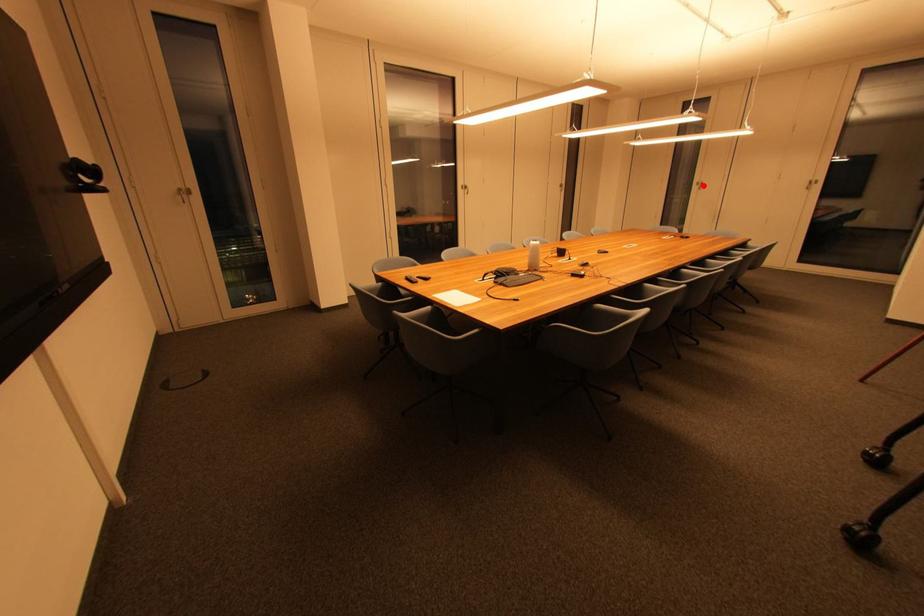
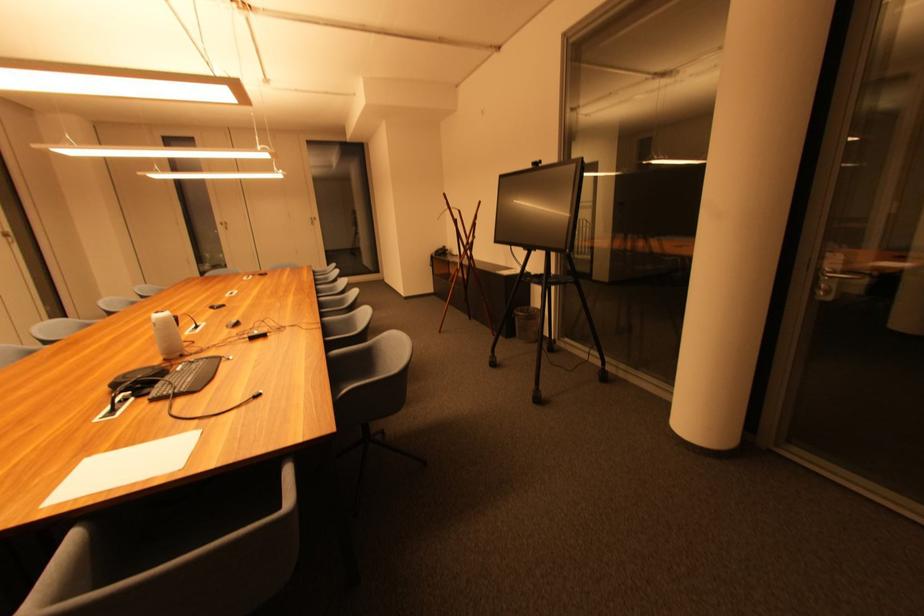
Find the pixel in the second image that matches the highlighted location in the first image.

(226, 225)